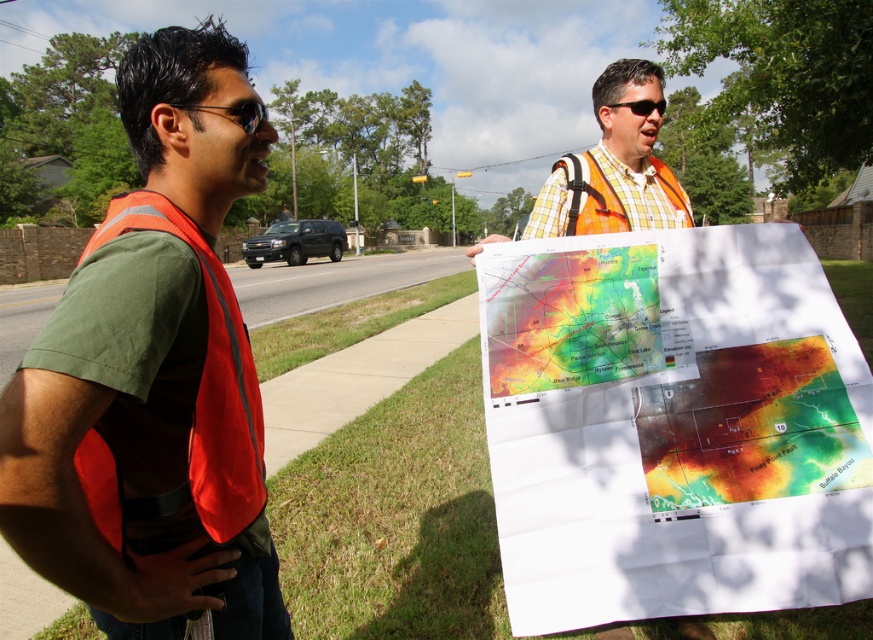
You are a hiker trying to navigate using the map. Which map should you focus on first, the matte paper map at center or the thermal map at center, based on their positions?

You should focus on the matte paper map at center first because it is closer to you than the thermal map at center.

You are a safety inspector observing the scene. You notice the checkered fabric shirt at center and the black plastic goggles at upper center. According to safety protocols, the goggles should be positioned higher than the shirt to ensure proper visibility. Is this requirement met in the current setup?

The checkered fabric shirt at center is located below the black plastic goggles at upper center, so the goggles are positioned higher than the shirt, meeting the safety requirement.